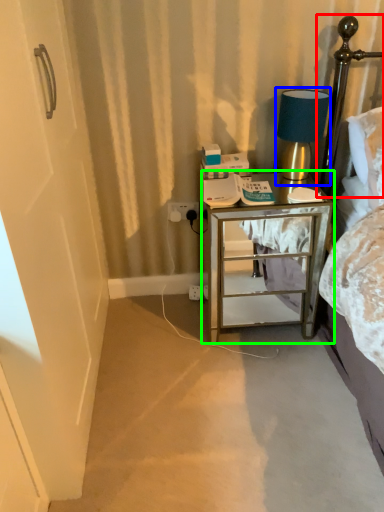
Question: Considering the real-world distances, which object is closest to headboard (highlighted by a red box)? table lamp (highlighted by a blue box) or nightstand (highlighted by a green box).

Choices:
 (A) table lamp
 (B) nightstand

Answer: (A)